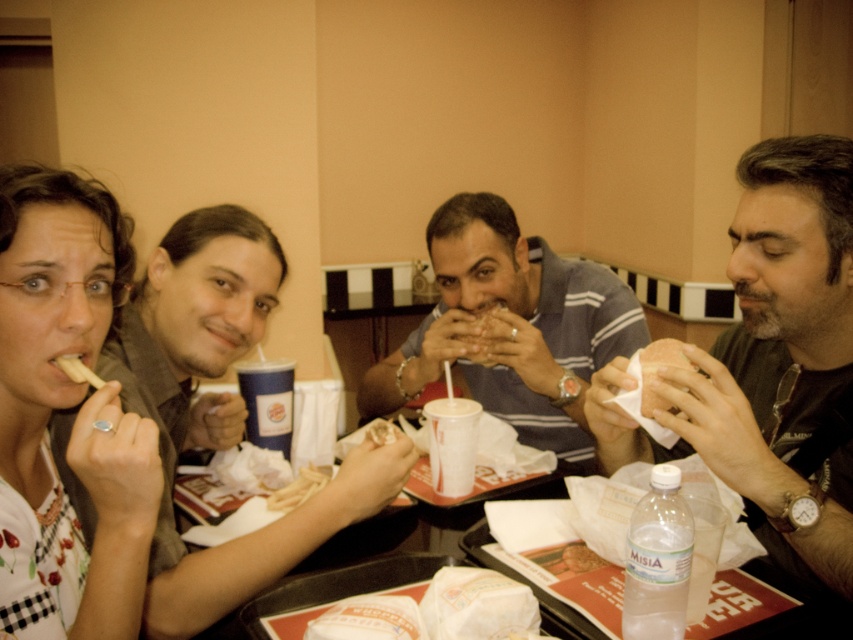
Between smooth brown shirt at left and clear plastic bottle at lower center, which one is positioned lower?

Positioned lower is clear plastic bottle at lower center.

Can you confirm if smooth brown shirt at left is smaller than clear plastic bottle at lower center?

Incorrect, smooth brown shirt at left is not smaller in size than clear plastic bottle at lower center.

Is point (83, 529) farther from camera compared to point (666, 582)?

Yes, it is.

The height and width of the screenshot is (640, 853). I want to click on smooth brown shirt at left, so click(x=219, y=412).

Which of these two, dark gray shirt at right or clear plastic bottle at lower center, stands taller?

dark gray shirt at right

Find the location of a particular element. This screenshot has height=640, width=853. dark gray shirt at right is located at coordinates (770, 365).

Find the location of a particular element. dark gray shirt at right is located at coordinates (770, 365).

Can you confirm if striped cotton shirt at center is positioned above fried golden french fries at center?

Correct, striped cotton shirt at center is located above fried golden french fries at center.

Does striped cotton shirt at center have a greater height compared to fried golden french fries at center?

Correct, striped cotton shirt at center is much taller as fried golden french fries at center.

Find the location of a particular element. striped cotton shirt at center is located at coordinates (515, 324).